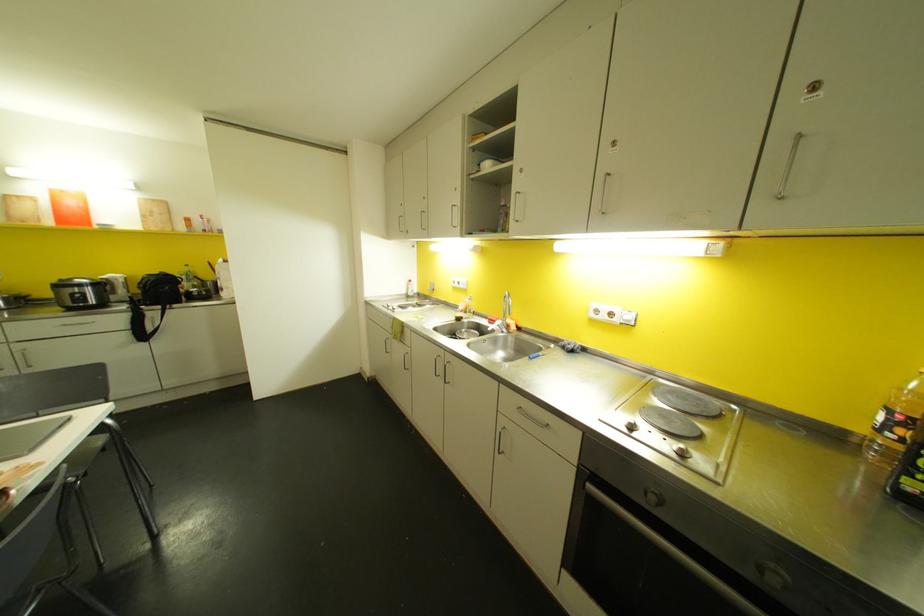
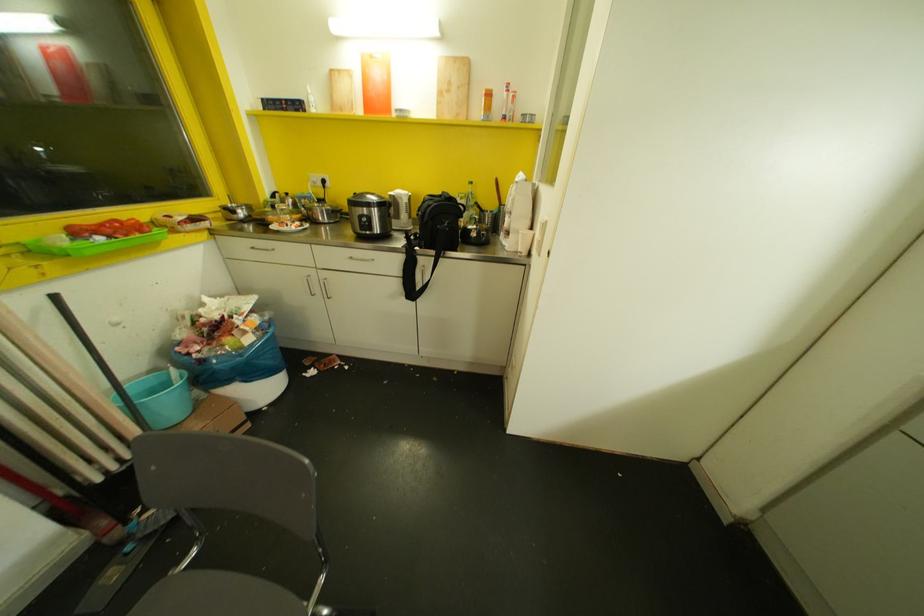
Locate, in the second image, the point that corresponds to point 113,292 in the first image.

(396, 216)